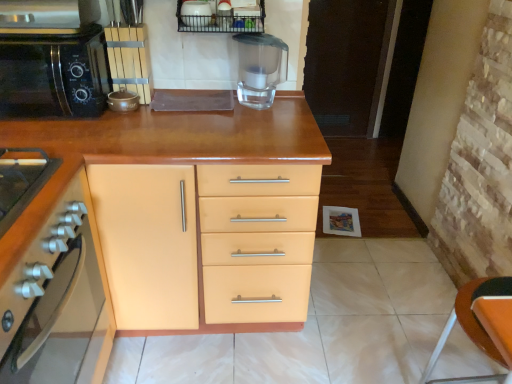
This screenshot has height=384, width=512. I want to click on free location in front of transparent plastic blender at center, so click(258, 125).